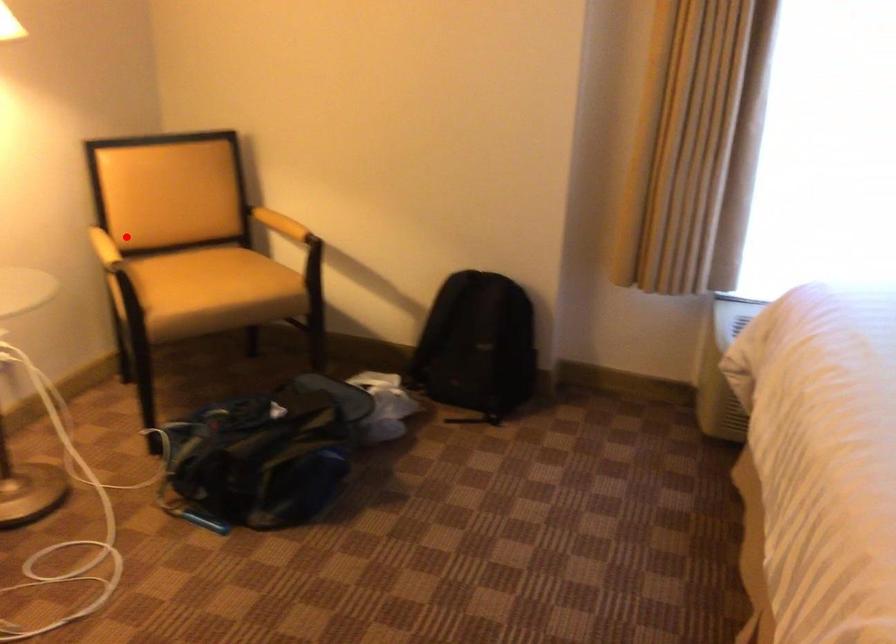
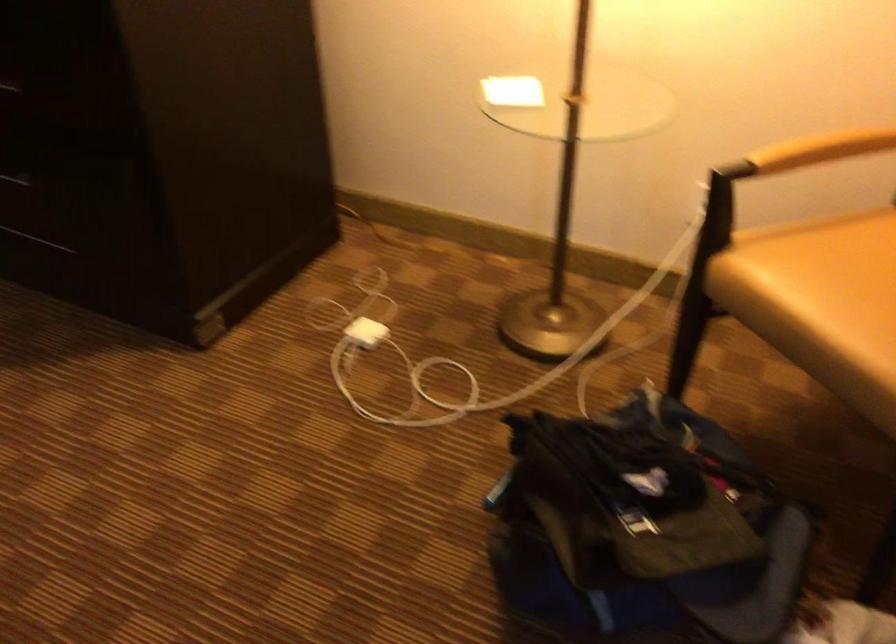
Question: I am providing you with two images of the same scene from different viewpoints. In image1, a red point is highlighted. Considering the same 3D point in image2, which of the following is correct?

Choices:
 (A) It is closer
 (B) It is farther

Answer: (A)